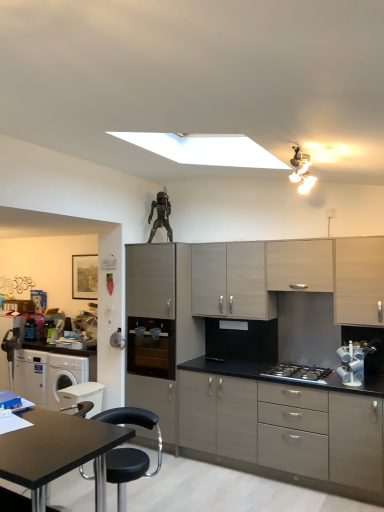
Question: Is light wood cabinet at center, arranged as the 3th cabinetry when viewed from the right, smaller than matte gray cabinet at center, the 4th cabinetry in the right-to-left sequence?

Choices:
 (A) yes
 (B) no

Answer: (A)

Question: From the image's perspective, is light wood cabinet at center, the second cabinetry viewed from the left, under matte gray cabinet at center, which appears as the 1th cabinetry when viewed from the left?

Choices:
 (A) no
 (B) yes

Answer: (A)

Question: Can you confirm if light wood cabinet at center, the second cabinetry viewed from the left, is bigger than matte gray cabinet at center, the 4th cabinetry in the right-to-left sequence?

Choices:
 (A) no
 (B) yes

Answer: (A)

Question: Is light wood cabinet at center, arranged as the 3th cabinetry when viewed from the right, facing towards matte gray cabinet at center, the 4th cabinetry in the right-to-left sequence?

Choices:
 (A) no
 (B) yes

Answer: (A)

Question: Considering the relative sizes of light wood cabinet at center, arranged as the 3th cabinetry when viewed from the right, and matte gray cabinet at center, which appears as the 1th cabinetry when viewed from the left, in the image provided, is light wood cabinet at center, arranged as the 3th cabinetry when viewed from the right, thinner than matte gray cabinet at center, which appears as the 1th cabinetry when viewed from the left,?

Choices:
 (A) no
 (B) yes

Answer: (B)

Question: From a real-world perspective, is matte gray cabinet at center, the 4th cabinetry in the right-to-left sequence, above or below black matte table at lower left?

Choices:
 (A) above
 (B) below

Answer: (A)

Question: Is matte gray cabinet at center, which appears as the 1th cabinetry when viewed from the left, inside or outside of black matte table at lower left?

Choices:
 (A) inside
 (B) outside

Answer: (B)

Question: Based on their sizes in the image, would you say matte gray cabinet at center, the 4th cabinetry in the right-to-left sequence, is bigger or smaller than black matte table at lower left?

Choices:
 (A) small
 (B) big

Answer: (B)

Question: Considering the positions of point (135, 373) and point (91, 432), is point (135, 373) closer or farther from the camera than point (91, 432)?

Choices:
 (A) closer
 (B) farther

Answer: (B)

Question: Would you say matte gray cabinets at lower right, arranged as the third cabinetry when viewed from the left, is inside or outside stainless steel gas stove at center?

Choices:
 (A) inside
 (B) outside

Answer: (B)

Question: From the image's perspective, is matte gray cabinets at lower right, the second cabinetry viewed from the right, above or below stainless steel gas stove at center?

Choices:
 (A) above
 (B) below

Answer: (B)

Question: From a real-world perspective, is matte gray cabinets at lower right, the second cabinetry viewed from the right, positioned above or below stainless steel gas stove at center?

Choices:
 (A) above
 (B) below

Answer: (B)

Question: Relative to stainless steel gas stove at center, is matte gray cabinets at lower right, the second cabinetry viewed from the right, in front or behind?

Choices:
 (A) behind
 (B) front

Answer: (B)

Question: Considering their positions, is stainless steel gas stove at center located in front of or behind black glass water dispenser at center?

Choices:
 (A) behind
 (B) front

Answer: (B)

Question: From the image's perspective, is stainless steel gas stove at center above or below black glass water dispenser at center?

Choices:
 (A) above
 (B) below

Answer: (B)